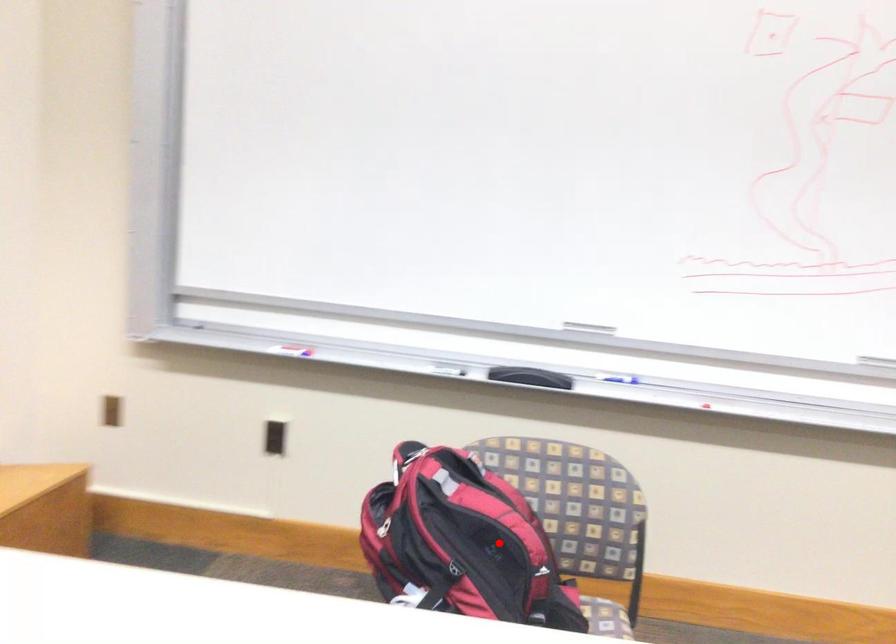
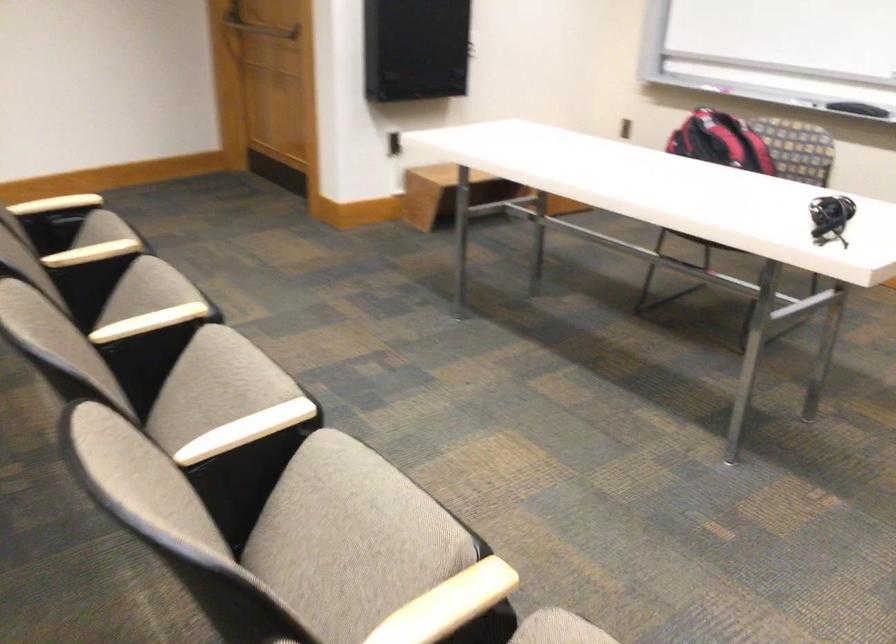
Question: A red point is marked in image1. In image2, is the corresponding 3D point closer to the camera or farther? Reply with the corresponding letter.

Choices:
 (A) The corresponding 3D point is closer.
 (B) The corresponding 3D point is farther.

Answer: (B)